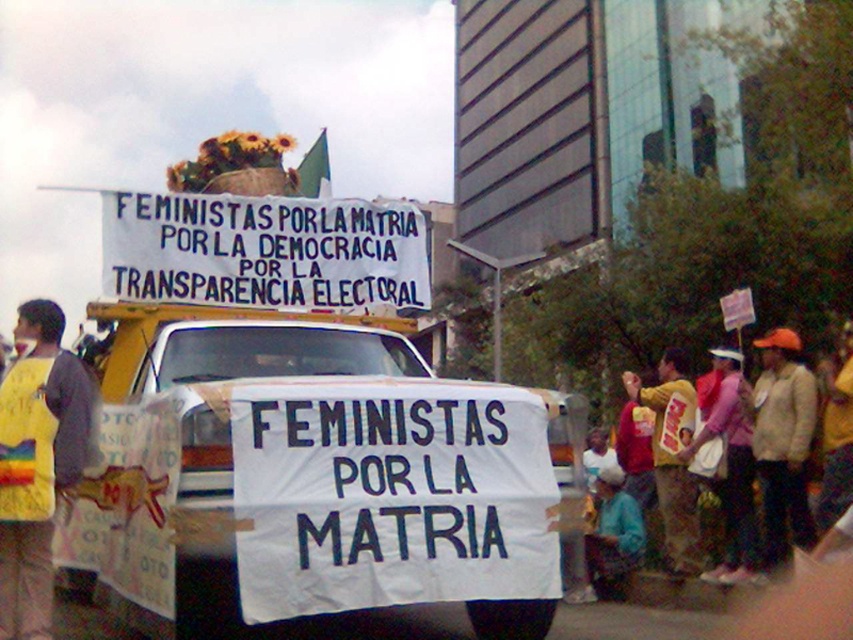
Question: Does white paper banner at center have a larger size compared to orange fabric jacket at right?

Choices:
 (A) no
 (B) yes

Answer: (B)

Question: Which object is positioned closest to the yellow fabric vest at left?

Choices:
 (A) orange fabric jacket at right
 (B) white paper banner at center
 (C) pink fabric bag at lower right
 (D) blue fabric at lower center

Answer: (B)

Question: Which of these objects is positioned closest to the yellow fabric shirt at right?

Choices:
 (A) white paper banner at upper center
 (B) white paper banner at center
 (C) yellow fabric vest at left

Answer: (A)

Question: Which of the following is the closest to the observer?

Choices:
 (A) orange fabric jacket at right
 (B) white paper banner at center
 (C) pink fabric bag at lower right
 (D) blue fabric at lower center

Answer: (B)

Question: Where is white paper banner at upper center located in relation to blue fabric at lower center in the image?

Choices:
 (A) right
 (B) left

Answer: (B)

Question: Can you confirm if yellow fabric vest at left is wider than blue fabric at lower center?

Choices:
 (A) no
 (B) yes

Answer: (B)